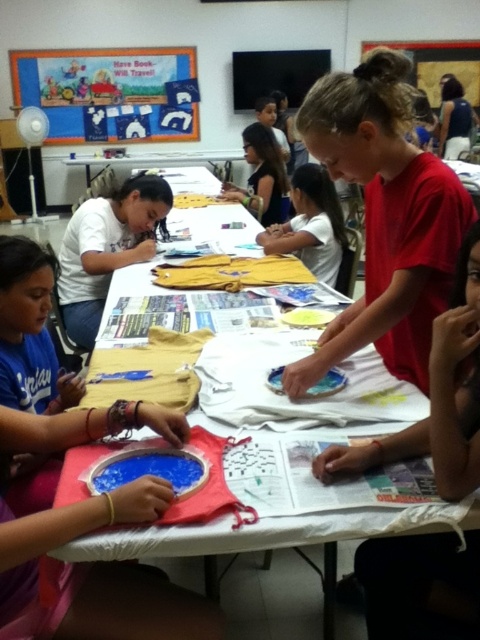
Can you confirm if red matte shirt at center is positioned below white paper at center?

No, red matte shirt at center is not below white paper at center.

Who is shorter, red matte shirt at center or white paper at center?

white paper at center

Is point (331, 337) positioned before point (278, 632)?

No, (331, 337) is further to viewer.

I want to click on red matte shirt at center, so click(384, 218).

Does blue fabric banner at upper left appear over white matte shirt at left?

Yes.

From the picture: Who is more forward, (x=144, y=131) or (x=72, y=333)?

Point (x=72, y=333) is in front.

Is point (110, 60) farther from viewer compared to point (60, 282)?

Yes, point (110, 60) is farther from viewer.

Find the location of a particular element. blue fabric banner at upper left is located at coordinates (110, 92).

Does white matte shirt at left appear under matte yellow shirt at upper center?

Indeed, white matte shirt at left is positioned under matte yellow shirt at upper center.

Can you confirm if white matte shirt at left is positioned to the right of matte yellow shirt at upper center?

No, white matte shirt at left is not to the right of matte yellow shirt at upper center.

Where is `white matte shirt at left`? The height and width of the screenshot is (640, 480). white matte shirt at left is located at coordinates (107, 248).